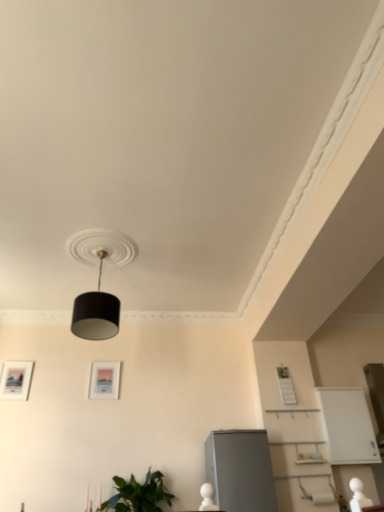
Question: Is white glossy cabinet at lower right touching satin grey refrigerator at lower right?

Choices:
 (A) yes
 (B) no

Answer: (B)

Question: Could you tell me if white glossy cabinet at lower right is turned towards satin grey refrigerator at lower right?

Choices:
 (A) no
 (B) yes

Answer: (A)

Question: Would you say satin grey refrigerator at lower right is part of white glossy cabinet at lower right's contents?

Choices:
 (A) yes
 (B) no

Answer: (B)

Question: Can you confirm if white glossy cabinet at lower right is wider than satin grey refrigerator at lower right?

Choices:
 (A) yes
 (B) no

Answer: (B)

Question: From a real-world perspective, is white glossy cabinet at lower right over satin grey refrigerator at lower right?

Choices:
 (A) yes
 (B) no

Answer: (A)

Question: Is white glossy cabinet at lower right to the right of satin grey refrigerator at lower right from the viewer's perspective?

Choices:
 (A) no
 (B) yes

Answer: (B)

Question: Is white matte picture frame at upper right, which is counted as the third picture frame, starting from the left, positioned in front of black matte lampshade at center?

Choices:
 (A) no
 (B) yes

Answer: (A)

Question: From the image's perspective, is white matte picture frame at upper right, which is counted as the third picture frame, starting from the left, located beneath black matte lampshade at center?

Choices:
 (A) yes
 (B) no

Answer: (A)

Question: Does white matte picture frame at upper right, positioned as the 1th picture frame in right-to-left order, contain black matte lampshade at center?

Choices:
 (A) yes
 (B) no

Answer: (B)

Question: Is white matte picture frame at upper right, which is counted as the third picture frame, starting from the left, to the left of black matte lampshade at center from the viewer's perspective?

Choices:
 (A) no
 (B) yes

Answer: (A)

Question: Considering the relative sizes of white matte picture frame at upper right, positioned as the 1th picture frame in right-to-left order, and black matte lampshade at center in the image provided, is white matte picture frame at upper right, positioned as the 1th picture frame in right-to-left order, taller than black matte lampshade at center?

Choices:
 (A) yes
 (B) no

Answer: (B)

Question: Is white matte picture frame at upper right, which is counted as the third picture frame, starting from the left, oriented away from black matte lampshade at center?

Choices:
 (A) no
 (B) yes

Answer: (A)

Question: Is matte black picture frame at left, which appears as the 3th picture frame when viewed from the right, at the right side of green leafy plant at lower left?

Choices:
 (A) no
 (B) yes

Answer: (A)